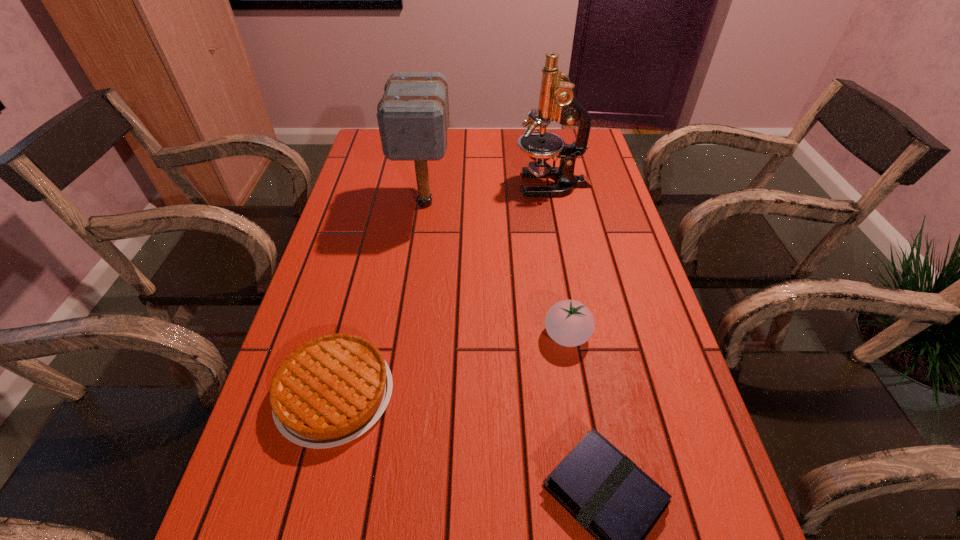
Identify the location of free point between the second shortest object and the tomato. (451, 364).

Locate an element on the screen. This screenshot has width=960, height=540. unoccupied area between the microscope and the pie is located at coordinates (444, 289).

Locate an element on the screen. free area in between the third tallest object and the mallet is located at coordinates (496, 269).

Where is `vacant point located between the microscope and the tomato`? Image resolution: width=960 pixels, height=540 pixels. vacant point located between the microscope and the tomato is located at coordinates (560, 260).

You are a GUI agent. You are given a task and a screenshot of the screen. Output one action in this format:
    pyautogui.click(x=<x>, y=<y>)
    Task: Click on the object that stands as the fourth closest to the tomato
    This screenshot has width=960, height=540.
    Given the screenshot: What is the action you would take?
    pyautogui.click(x=557, y=101)

Select which object is the third closest to the pie. Please provide its 2D coordinates. Your answer should be formatted as a tuple, i.e. [(x, y)], where the tuple contains the x and y coordinates of a point satisfying the conditions above.

[(413, 115)]

You are a GUI agent. You are given a task and a screenshot of the screen. Output one action in this format:
    pyautogui.click(x=<x>, y=<y>)
    Task: Click on the free space that satisfies the following two spatial constraints: 1. at the eyepiece of the microscope; 2. on the striking surface of the mallet
    
    Given the screenshot: What is the action you would take?
    pyautogui.click(x=556, y=203)

Locate an element on the screen. blank area in the image that satisfies the following two spatial constraints: 1. at the eyepiece of the microscope; 2. on the striking surface of the mallet is located at coordinates (556, 203).